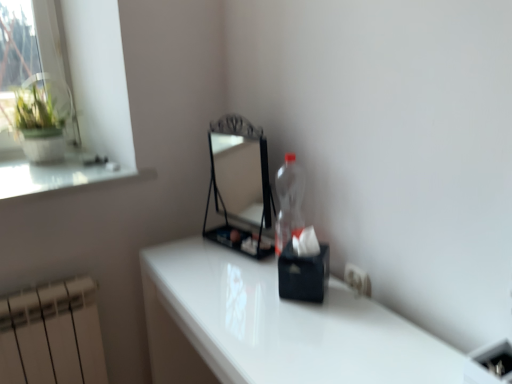
Question: Does metallic black mirror at center come in front of white plastic electric outlet at lower right?

Choices:
 (A) no
 (B) yes

Answer: (A)

Question: Can you confirm if metallic black mirror at center is smaller than white plastic electric outlet at lower right?

Choices:
 (A) yes
 (B) no

Answer: (B)

Question: Does metallic black mirror at center appear on the left side of white plastic electric outlet at lower right?

Choices:
 (A) yes
 (B) no

Answer: (A)

Question: Does metallic black mirror at center have a lesser width compared to white plastic electric outlet at lower right?

Choices:
 (A) yes
 (B) no

Answer: (B)

Question: Is white plastic electric outlet at lower right a part of metallic black mirror at center?

Choices:
 (A) yes
 (B) no

Answer: (B)

Question: Is white plastic electric outlet at lower right wider or thinner than metallic black mirror at center?

Choices:
 (A) thin
 (B) wide

Answer: (A)

Question: In the image, is white plastic electric outlet at lower right positioned in front of or behind metallic black mirror at center?

Choices:
 (A) behind
 (B) front

Answer: (B)

Question: In the image, is white plastic electric outlet at lower right on the left side or the right side of metallic black mirror at center?

Choices:
 (A) left
 (B) right

Answer: (B)

Question: From the image's perspective, is white plastic electric outlet at lower right positioned above or below metallic black mirror at center?

Choices:
 (A) above
 (B) below

Answer: (B)

Question: In terms of width, does white glossy table at center look wider or thinner when compared to white plastic electric outlet at lower right?

Choices:
 (A) wide
 (B) thin

Answer: (A)

Question: Relative to white plastic electric outlet at lower right, is white glossy table at center in front or behind?

Choices:
 (A) behind
 (B) front

Answer: (B)

Question: From a real-world perspective, relative to white plastic electric outlet at lower right, is white glossy table at center vertically above or below?

Choices:
 (A) below
 (B) above

Answer: (A)

Question: From their relative heights in the image, would you say white glossy table at center is taller or shorter than white plastic electric outlet at lower right?

Choices:
 (A) tall
 (B) short

Answer: (A)

Question: Is metallic black mirror at center spatially inside white glossy table at center, or outside of it?

Choices:
 (A) outside
 (B) inside

Answer: (A)

Question: Is metallic black mirror at center in front of or behind white glossy table at center in the image?

Choices:
 (A) front
 (B) behind

Answer: (B)